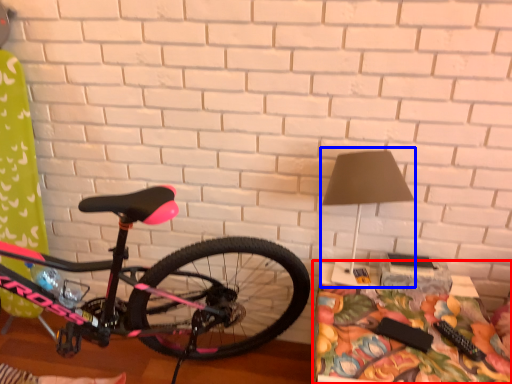
Question: Among these objects, which one is farthest to the camera, table (highlighted by a red box) or table lamp (highlighted by a blue box)?

Choices:
 (A) table
 (B) table lamp

Answer: (B)